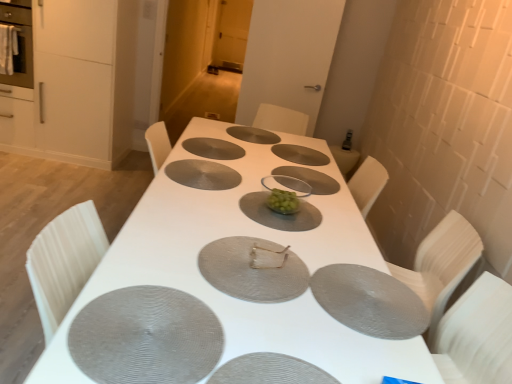
Image resolution: width=512 pixels, height=384 pixels. Identify the location of empty space that is ontop of gray textured placemat at center, marked as the 2th pizza pan in a front-to-back arrangement (from a real-world perspective). (149, 324).